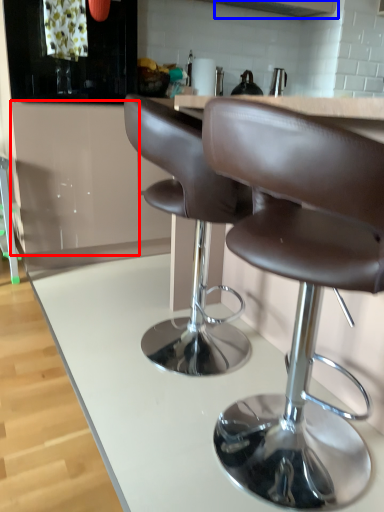
Question: Which of the following is the farthest to the observer, cabinetry (highlighted by a red box) or exhaust hood (highlighted by a blue box)?

Choices:
 (A) cabinetry
 (B) exhaust hood

Answer: (B)